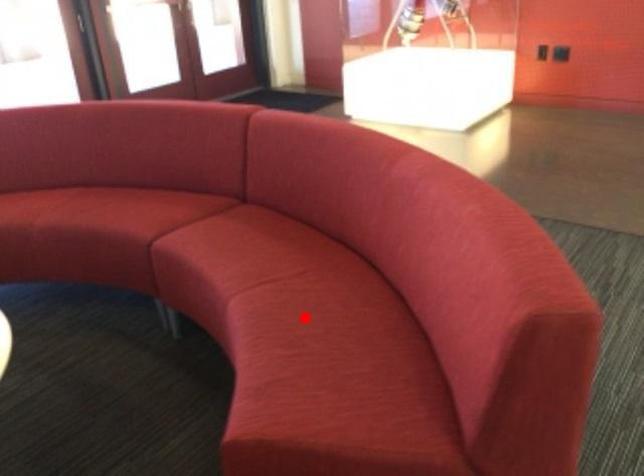
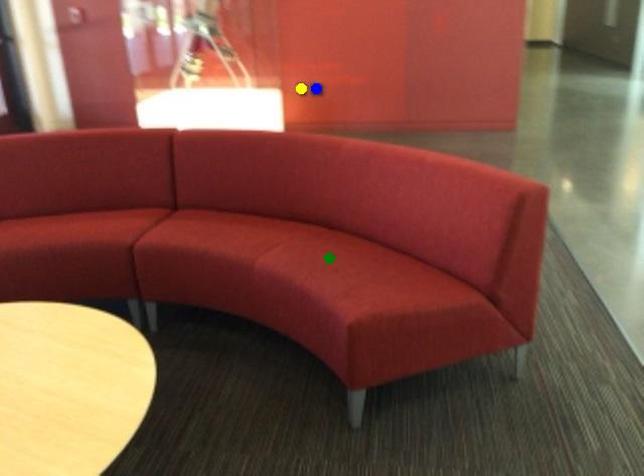
Question: I am providing you with two images of the same scene from different viewpoints. A red point is marked on the first image. You are given multiple points on the second image. In image 2, which mark is for the same physical point as the one in image 1?

Choices:
 (A) yellow point
 (B) blue point
 (C) green point

Answer: (C)